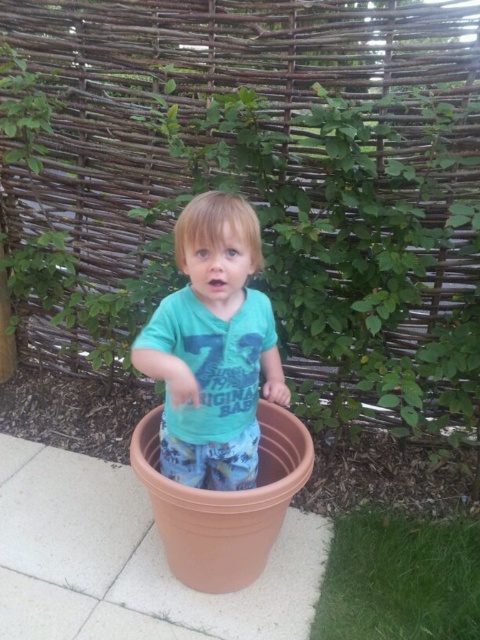
You are a photographer setting up a shot of the child in the terracotta pot. You want to ensure both the green grass at lower right and the green leafy plant at upper left are visible in the frame. Which object should you focus on first to keep both in focus?

You should focus on the green grass at lower right first because it is closer to the viewer than the green leafy plant at upper left. By focusing on the closer object, the farther one will still be in focus due to depth of field.

Please describe the position of the green matte shirt at center in terms of its coordinates within the image frame. Use the provided coordinate system where the origin is at the bottom left corner of the image and the values range from 0 to 1 in both x and y axes.

The green matte shirt at center is located at coordinates approximately 0.545 on the x axis and 0.444 on the y axis within the image frame.